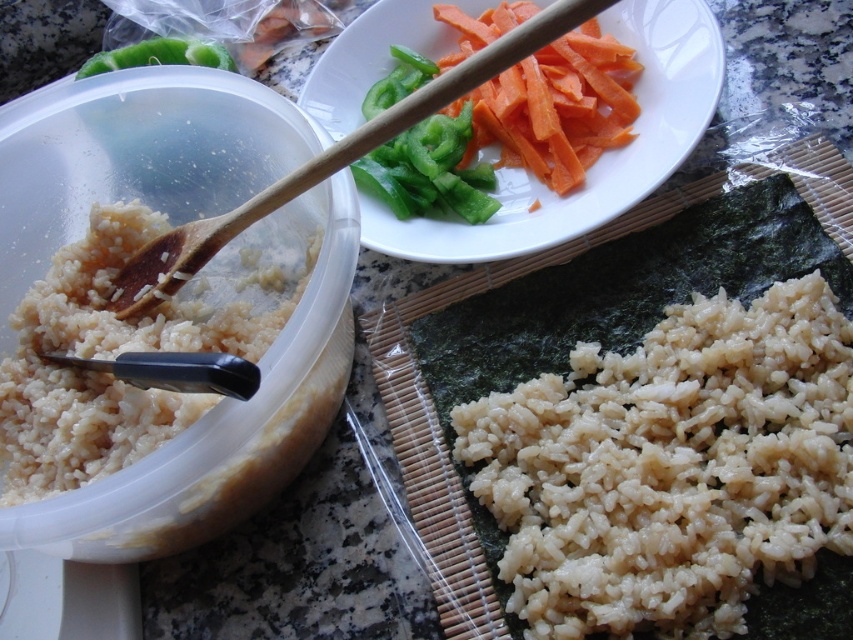
Question: Which point is farther to the camera?

Choices:
 (A) wooden spoon at upper left
 (B) slightly translucent brown rice at lower right
 (C) sliced orange carrot at upper right

Answer: (C)

Question: From the image, what is the correct spatial relationship of white matte rice at center left in relation to green matte bell pepper at upper left?

Choices:
 (A) left
 (B) right

Answer: (B)

Question: From the image, what is the correct spatial relationship of slightly translucent brown rice at lower right in relation to sliced orange carrot at upper right?

Choices:
 (A) above
 (B) below

Answer: (B)

Question: Can you confirm if sliced orange carrot at upper right is bigger than wooden spoon at upper left?

Choices:
 (A) no
 (B) yes

Answer: (A)

Question: Which point is closer to the camera taking this photo?

Choices:
 (A) (466, 129)
 (B) (200, 401)
 (C) (186, 51)
 (D) (677, 72)

Answer: (B)

Question: Based on their relative distances, which object is nearer to the smooth white bowl at upper center?

Choices:
 (A) slightly translucent brown rice at lower right
 (B) white matte rice at center left
 (C) wooden spoon at upper left
 (D) green matte bell pepper at upper left

Answer: (A)